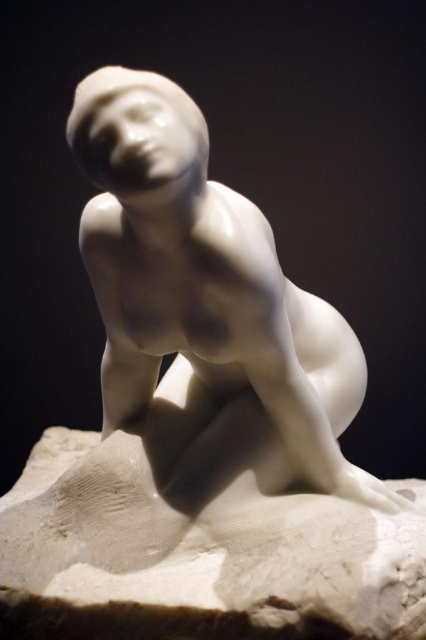
Is point (71, 118) in front of point (45, 493)?

Yes, point (71, 118) is in front of point (45, 493).

Who is higher up, white glossy statue at center or white marble base at lower center?

white glossy statue at center is higher up.

You are a GUI agent. You are given a task and a screenshot of the screen. Output one action in this format:
    pyautogui.click(x=<x>, y=<y>)
    Task: Click on the white glossy statue at center
    
    Given the screenshot: What is the action you would take?
    pyautogui.click(x=204, y=282)

The width and height of the screenshot is (426, 640). What are the coordinates of `white glossy statue at center` in the screenshot? It's located at (204, 282).